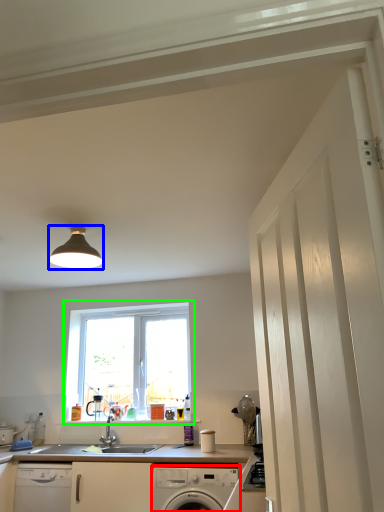
Question: Which object is positioned closest to home appliance (highlighted by a red box)? Select from light fixture (highlighted by a blue box) and window (highlighted by a green box).

Choices:
 (A) light fixture
 (B) window

Answer: (B)